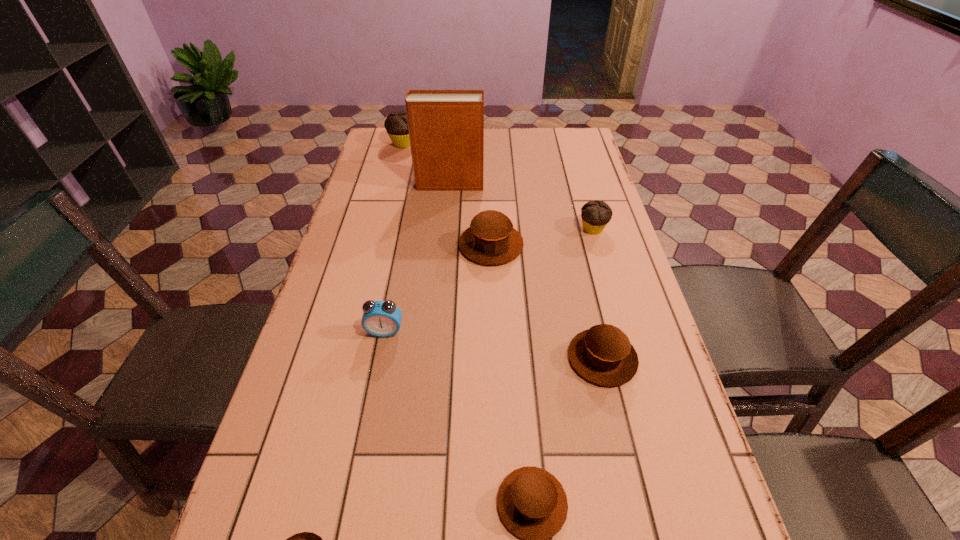
You are a GUI agent. You are given a task and a screenshot of the screen. Output one action in this format:
    pyautogui.click(x=<x>, y=<y>)
    Task: Click on the vacant space at the far edge
    
    Given the screenshot: What is the action you would take?
    pyautogui.click(x=498, y=144)

Image resolution: width=960 pixels, height=540 pixels. What are the coordinates of `free space at the left edge` in the screenshot? It's located at (370, 201).

Identify the location of free location at the right edge of the desktop. (632, 399).

Locate an element on the screen. Image resolution: width=960 pixels, height=540 pixels. empty location between the nearer chocolate muffin and the farthest brown muffin is located at coordinates (542, 237).

Locate an element on the screen. This screenshot has height=540, width=960. vacant area that lies between the second biggest brown muffin and the biggest brown muffin is located at coordinates (547, 302).

Where is `unoccupied area between the farthest object and the farthest brown muffin`? unoccupied area between the farthest object and the farthest brown muffin is located at coordinates (447, 194).

Image resolution: width=960 pixels, height=540 pixels. I want to click on blank region between the hardback book and the farthest brown muffin, so click(470, 214).

Find the location of a particular element. vacant area that lies between the hardback book and the right chocolate muffin is located at coordinates (521, 206).

Locate an element on the screen. blank region between the rightmost brown muffin and the farthest brown muffin is located at coordinates (547, 302).

Locate an element on the screen. The width and height of the screenshot is (960, 540). object that is the second closest to the fifth tallest muffin is located at coordinates (304, 539).